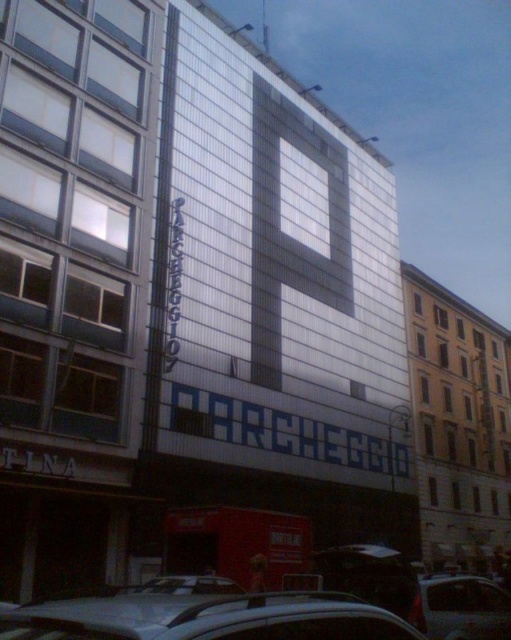
Question: From the image, what is the correct spatial relationship of silver metallic car at lower center in relation to metallic gray sedan at lower right?

Choices:
 (A) above
 (B) below

Answer: (A)

Question: Is silver metallic car at lower center bigger than metallic gray sedan at lower right?

Choices:
 (A) yes
 (B) no

Answer: (B)

Question: Does silver metallic car at lower center appear on the right side of metallic gray sedan at lower right?

Choices:
 (A) no
 (B) yes

Answer: (A)